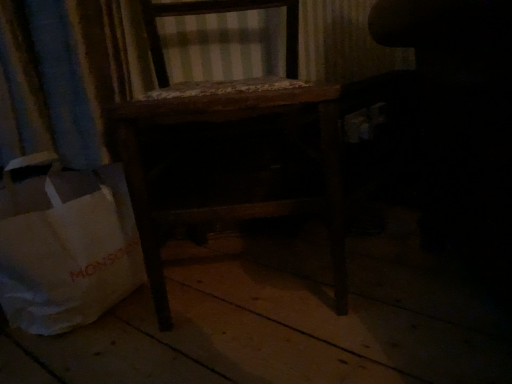
At what (x,y) coordinates should I click in order to perform the action: click on vacant area situated below white paper bag at lower left (from a real-world perspective). Please return your answer as a coordinate pair (x, y). The height and width of the screenshot is (384, 512). Looking at the image, I should click on (58, 337).